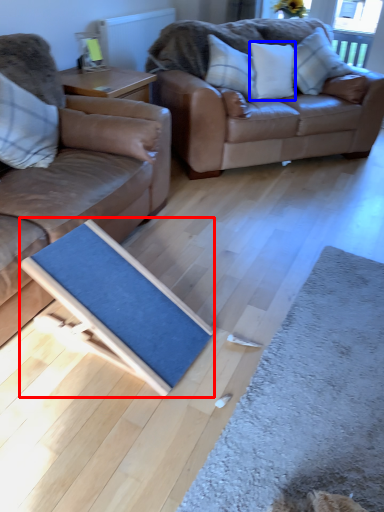
Question: Which object is further to the camera taking this photo, doormat (highlighted by a red box) or pillow (highlighted by a blue box)?

Choices:
 (A) doormat
 (B) pillow

Answer: (B)